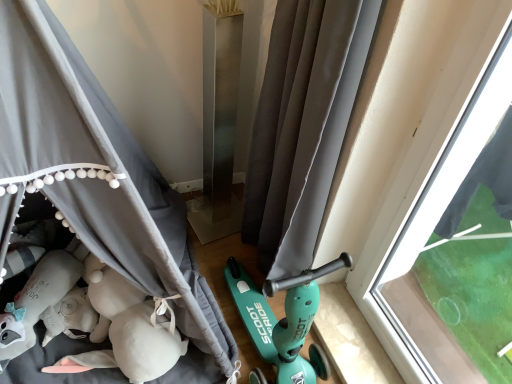
Question: Should I look upward or downward to see transparent glass window at right?

Choices:
 (A) down
 (B) up

Answer: (A)

Question: Is transparent glass window at right located within gray fabric curtain at center, arranged as the 1th curtain when viewed from the left?

Choices:
 (A) yes
 (B) no

Answer: (B)

Question: Can you confirm if gray fabric curtain at center, arranged as the 1th curtain when viewed from the left, is smaller than transparent glass window at right?

Choices:
 (A) no
 (B) yes

Answer: (A)

Question: Is gray fabric curtain at center, which ranks as the second curtain in right-to-left order, at the right side of transparent glass window at right?

Choices:
 (A) no
 (B) yes

Answer: (A)

Question: Is gray fabric curtain at center, which ranks as the second curtain in right-to-left order, oriented towards transparent glass window at right?

Choices:
 (A) no
 (B) yes

Answer: (A)

Question: Is gray fabric curtain at center, which ranks as the second curtain in right-to-left order, positioned far away from transparent glass window at right?

Choices:
 (A) no
 (B) yes

Answer: (A)

Question: Can you confirm if gray fabric curtain at center, which ranks as the second curtain in right-to-left order, is thinner than transparent glass window at right?

Choices:
 (A) no
 (B) yes

Answer: (A)

Question: Is the depth of gray fabric curtain at center, arranged as the 2th curtain when viewed from the left, less than that of gray fabric curtain at center, which ranks as the second curtain in right-to-left order?

Choices:
 (A) yes
 (B) no

Answer: (B)

Question: Is gray fabric curtain at center, arranged as the 2th curtain when viewed from the left, shorter than gray fabric curtain at center, arranged as the 1th curtain when viewed from the left?

Choices:
 (A) no
 (B) yes

Answer: (B)

Question: Is gray fabric curtain at center, arranged as the 1th curtain when viewed from the left, at the back of gray fabric curtain at center, the 1th curtain in the right-to-left sequence?

Choices:
 (A) yes
 (B) no

Answer: (A)

Question: Could you tell me if gray fabric curtain at center, the 1th curtain in the right-to-left sequence, is turned towards gray fabric curtain at center, arranged as the 1th curtain when viewed from the left?

Choices:
 (A) no
 (B) yes

Answer: (B)

Question: Does gray fabric curtain at center, the 1th curtain in the right-to-left sequence, have a larger size compared to gray fabric curtain at center, which ranks as the second curtain in right-to-left order?

Choices:
 (A) no
 (B) yes

Answer: (A)

Question: From the image's perspective, is gray fabric curtain at center, arranged as the 2th curtain when viewed from the left, under gray fabric curtain at center, arranged as the 1th curtain when viewed from the left?

Choices:
 (A) no
 (B) yes

Answer: (A)

Question: Does transparent glass window at right have a greater width compared to gray fabric curtain at center, which ranks as the second curtain in right-to-left order?

Choices:
 (A) yes
 (B) no

Answer: (B)